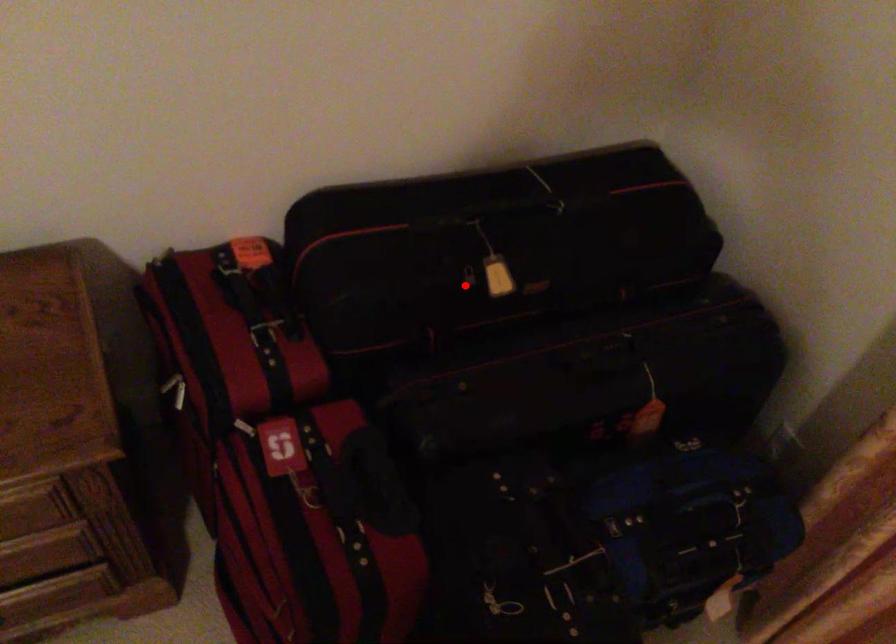
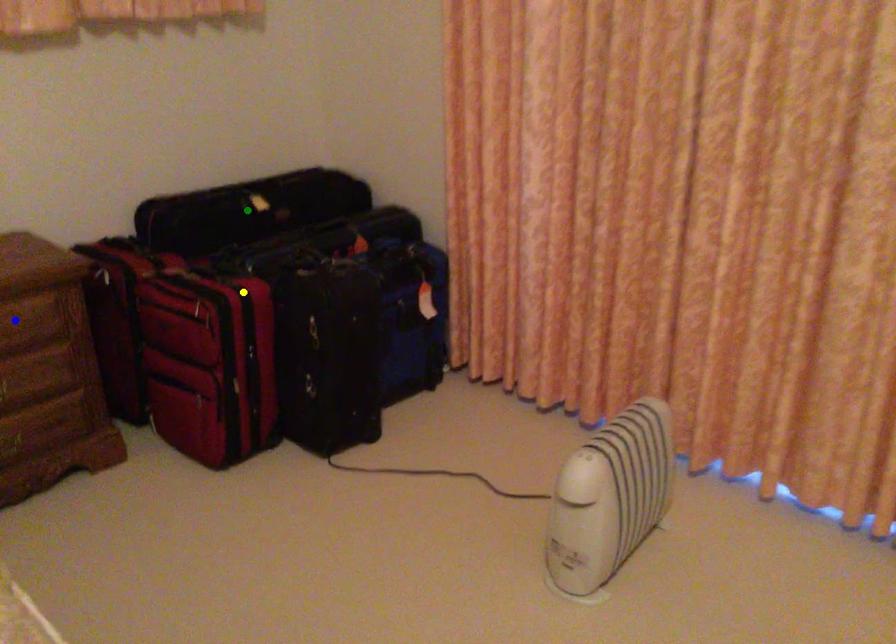
Question: I am providing you with two images of the same scene from different viewpoints. A red point is marked on the first image. You are given multiple points on the second image. Which point in image 2 represents the same 3d spot as the red point in image 1?

Choices:
 (A) green point
 (B) yellow point
 (C) blue point

Answer: (A)